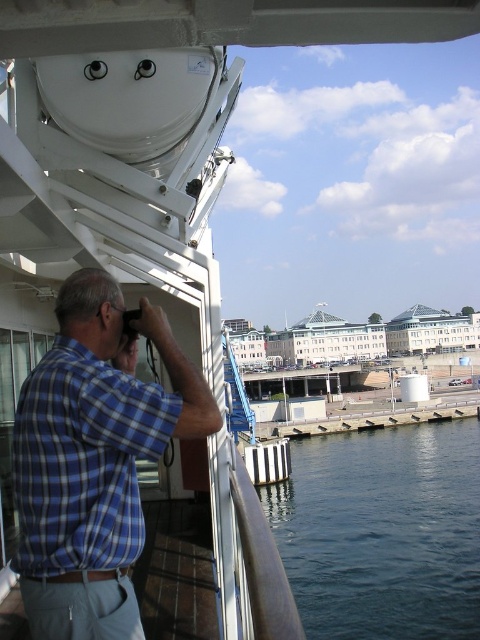
You are a photographer standing on the deck of the ship. You have a camera and want to capture the scene. The blue plaid shirt at left and the dark blue water at lower right are both in your viewfinder. Which object is positioned to the left of the other?

The blue plaid shirt at left is positioned on the left side of dark blue water at lower right.

You are a photographer standing on the ship deck. You want to take a photo of the cityscape in the background. The camera you need is 46.15 feet away from you, which is the distance between you and the blue plaid shirt at left. Can you reach the camera in time if you can walk 3 feet per second?

The distance between you and the blue plaid shirt at left is 46.15 feet. At a walking speed of 3 feet per second, it would take approximately 15.38 seconds to reach the camera. Whether you can reach it in time depends on how much time you have available.

You are on the ship deck and want to take a photo of the dark blue water at lower right without the blue plaid shirt at left appearing in the frame. Is this possible given their positions?

The blue plaid shirt at left is located above the dark blue water at lower right, so if you position yourself below the shirt or adjust your angle to exclude it, you can capture the water without the shirt in the frame.